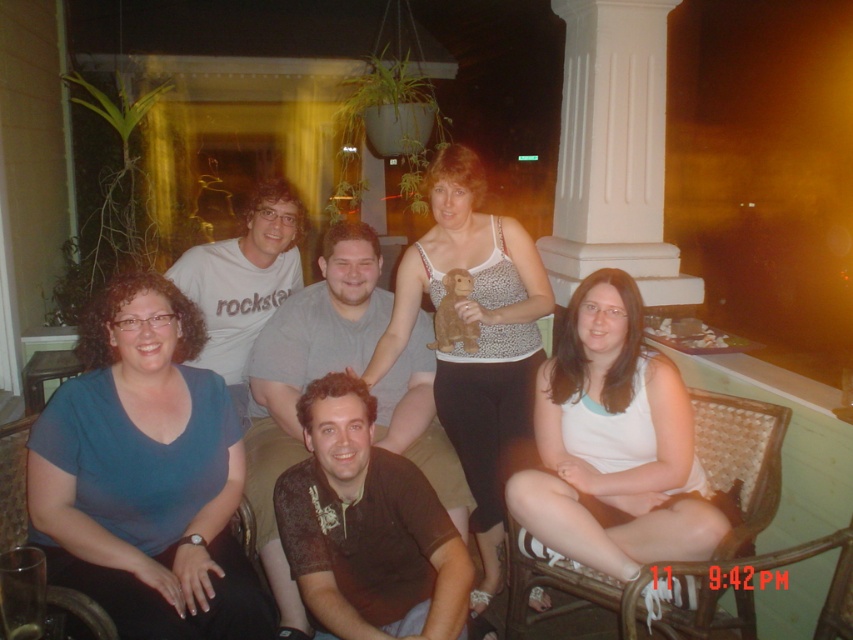
Question: Which of the following is the farthest from the observer?

Choices:
 (A) (621, 42)
 (B) (383, 388)
 (C) (229, 355)
 (D) (10, 536)

Answer: (A)

Question: Estimate the real-world distances between objects in this image. Which object is closer to the leopard print tank top at center?

Choices:
 (A) matte gray t-shirt at center
 (B) white smooth column at upper center
 (C) brown woven chair at lower left
 (D) woven wicker chair at lower right

Answer: (D)

Question: Is leopard print tank top at center wider than white smooth column at upper center?

Choices:
 (A) no
 (B) yes

Answer: (A)

Question: Is white smooth column at upper center above dark brown cotton shirt at center?

Choices:
 (A) no
 (B) yes

Answer: (B)

Question: Can you confirm if blue fabric shirt at lower left is bigger than dark brown cotton shirt at center?

Choices:
 (A) yes
 (B) no

Answer: (B)

Question: Among these points, which one is farthest from the camera?

Choices:
 (A) (374, 390)
 (B) (587, 212)
 (C) (229, 307)
 (D) (697, 429)

Answer: (B)